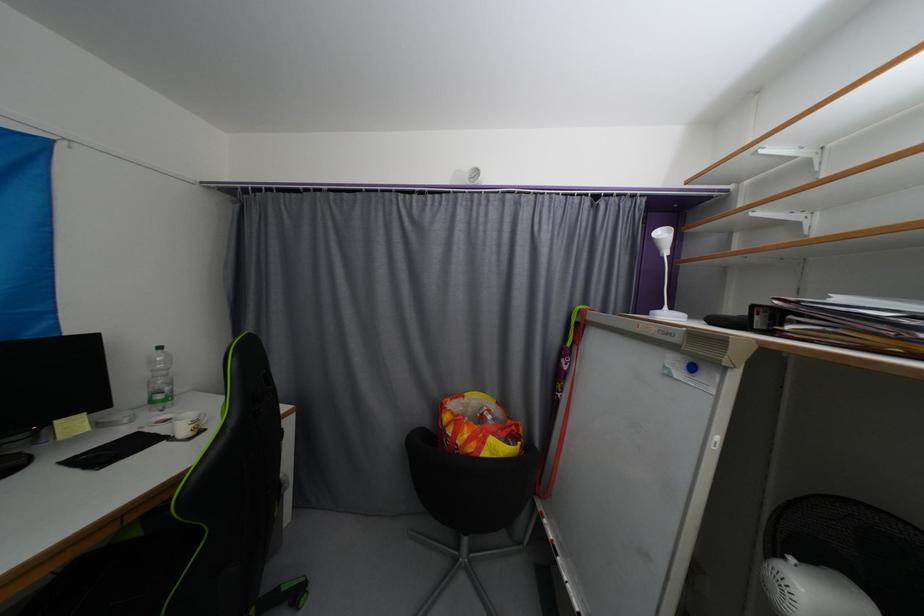
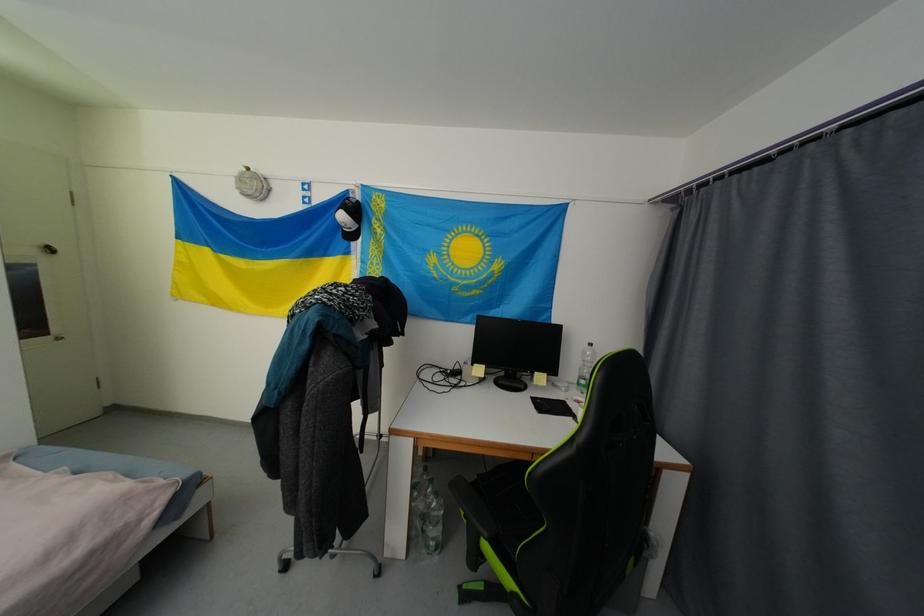
Question: How did the camera likely rotate?

Choices:
 (A) Left
 (B) Right
 (C) Up
 (D) Down

Answer: (A)